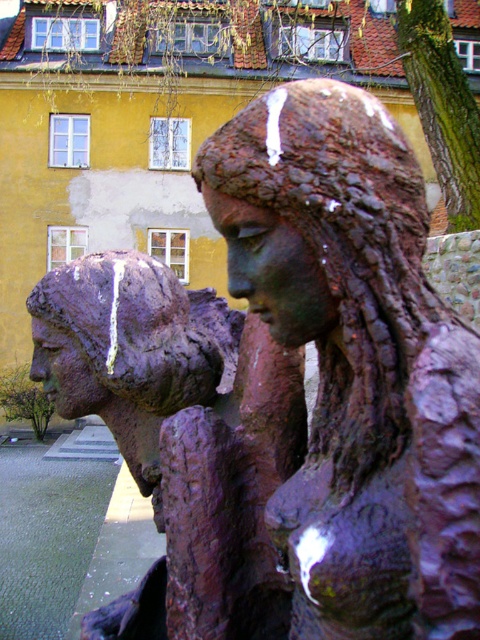
You are standing in front of the two weathered bronze sculptures. The rusty bronze statue at center is the one closer to you. Which statue is closer to you?

The rusty bronze statue at center is closer to you as it is only 3.64 feet away from the viewer.

You are standing in front of the two bronze sculptures. You notice two points marked on the sculptures. The first point is at coordinate point (316,474), and the second point is at coordinate point (284,371). Which point is nearer to you?

Point (316,474) is closer to the camera than point (284,371), so the first point is nearer to you.